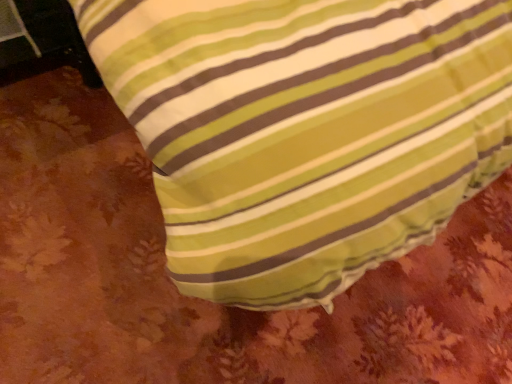
Describe the element at coordinates (305, 130) in the screenshot. The width and height of the screenshot is (512, 384). I see `green striped pillow at upper center` at that location.

Find the location of `green striped pillow at upper center`. green striped pillow at upper center is located at coordinates (305, 130).

In order to face green striped pillow at upper center, should I rotate leftwards or rightwards?

Turn right approximately 11.828 degrees to face it.

You are a GUI agent. You are given a task and a screenshot of the screen. Output one action in this format:
    pyautogui.click(x=<x>, y=<y>)
    Task: Click on the green striped pillow at upper center
    
    Given the screenshot: What is the action you would take?
    pyautogui.click(x=305, y=130)